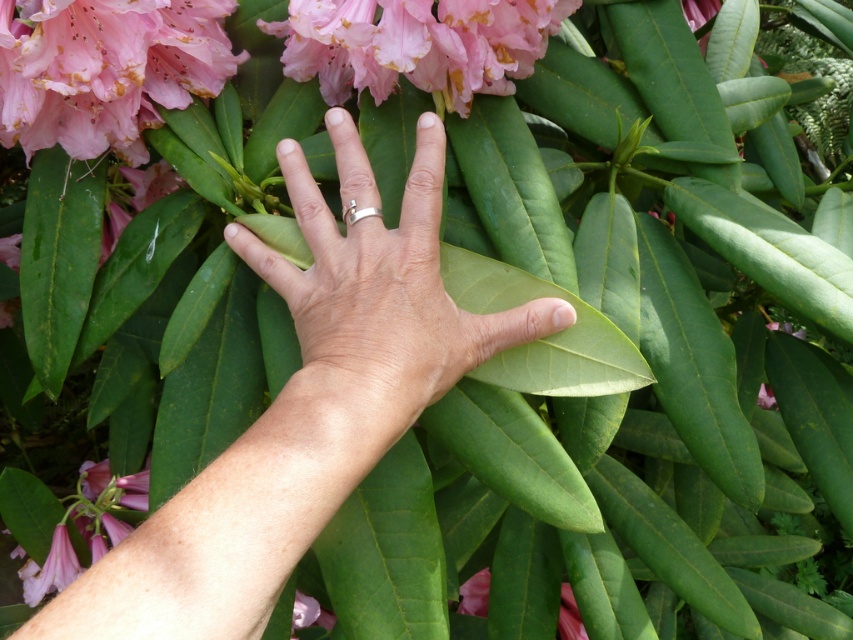
Question: Does satin gold ring at center appear on the left side of pink glossy flower at upper center?

Choices:
 (A) no
 (B) yes

Answer: (B)

Question: Which object is the closest to the matte pink flower at center?

Choices:
 (A) pink matte flower at lower left
 (B) matte pink petals at upper left

Answer: (A)

Question: Is matte pink petals at upper left behind pink matte flower at lower left?

Choices:
 (A) no
 (B) yes

Answer: (A)

Question: Which point is closer to the camera taking this photo?

Choices:
 (A) pos(0,506)
 (B) pos(578,630)

Answer: (A)

Question: Can you confirm if pink matte flower at lower left is smaller than matte pink flower at center?

Choices:
 (A) yes
 (B) no

Answer: (B)

Question: Which is nearer to the satin gold ring at center?

Choices:
 (A) skinny silver ring at center
 (B) pink matte flower at lower left
 (C) pink glossy flower at upper center
 (D) matte pink petals at upper left

Answer: (A)